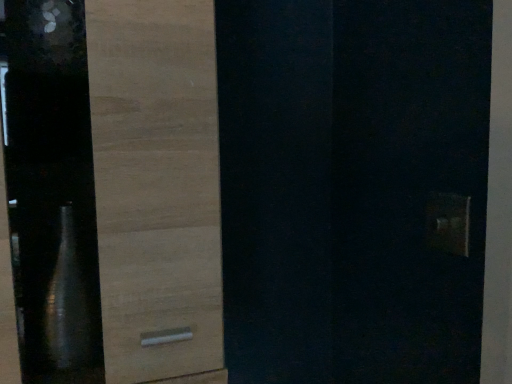
Question: Should I look upward or downward to see wooden drawer at left?

Choices:
 (A) up
 (B) down

Answer: (A)